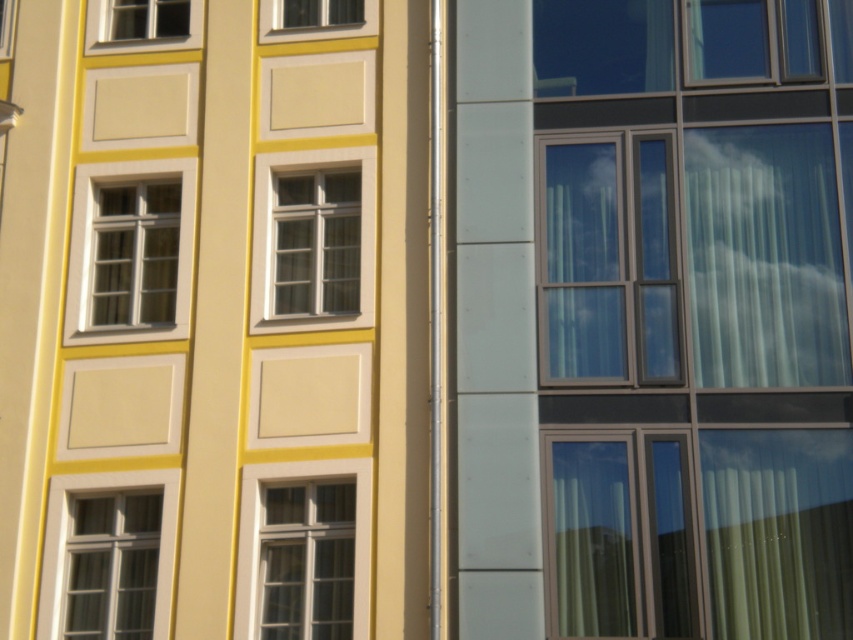
Question: Based on their relative distances, which object is nearer to the transparent glass window at center?

Choices:
 (A) matte white window at left
 (B) matte white window at upper center
 (C) matte white window at lower left

Answer: (B)

Question: Which object appears farthest from the camera in this image?

Choices:
 (A) matte white window at center
 (B) matte white window at upper left

Answer: (B)

Question: From the image, what is the correct spatial relationship of matte white window at left in relation to matte white window at upper left?

Choices:
 (A) left
 (B) right

Answer: (B)

Question: Can you confirm if matte white window at lower left is positioned to the right of matte white window at upper left?

Choices:
 (A) yes
 (B) no

Answer: (A)

Question: From the image, what is the correct spatial relationship of matte white window at lower left in relation to matte glass window at upper left?

Choices:
 (A) left
 (B) right

Answer: (B)

Question: Which of the following is the farthest from the observer?

Choices:
 (A) (158, 509)
 (B) (300, 262)
 (C) (315, 621)
 (D) (601, 276)

Answer: (B)